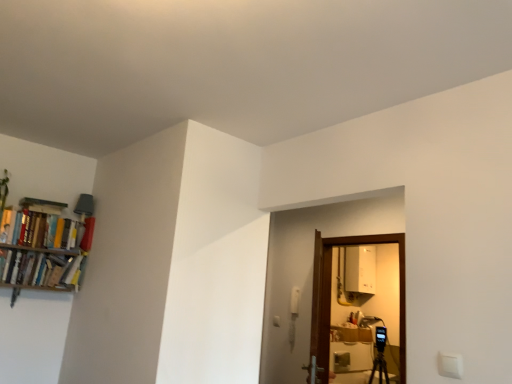
Locate an element on the screen. hardcover books at left, which is the 1th book from top to bottom is located at coordinates (44, 230).

Measure the distance between point (53, 253) and camera.

The distance of point (53, 253) from camera is 2.90 meters.

You are a GUI agent. You are given a task and a screenshot of the screen. Output one action in this format:
    pyautogui.click(x=<x>, y=<y>)
    Task: Click on the matte red book at upper left, which appears as the second book when ordered from the bottom
    The height and width of the screenshot is (384, 512).
    Given the screenshot: What is the action you would take?
    pyautogui.click(x=87, y=234)

Which is behind, matte red book at upper left, which is counted as the 2th book, starting from the top, or hardcover books at left, which ranks as the 3th book in bottom-to-top order?

matte red book at upper left, which is counted as the 2th book, starting from the top, is behind.

Is matte red book at upper left, which appears as the second book when ordered from the bottom, thinner than hardcover books at left, which is the 1th book from top to bottom?

Correct, the width of matte red book at upper left, which appears as the second book when ordered from the bottom, is less than that of hardcover books at left, which is the 1th book from top to bottom.

At what (x,y) coordinates should I click in order to perform the action: click on the 2nd book counting from the right side of the hardcover books at left, which is the 1th book from top to bottom. Please return your answer as a coordinate pair (x, y). The height and width of the screenshot is (384, 512). Looking at the image, I should click on (87, 234).

The height and width of the screenshot is (384, 512). Identify the location of the 1st book to the right of the hardcover books at left, which is the 1th book from top to bottom, counting from the anchor's position. (35, 268).

From the image's perspective, who appears lower, hardcover books at left, which is the 1th book in bottom-to-top order, or hardcover books at left, which is the 1th book from top to bottom?

hardcover books at left, which is the 1th book in bottom-to-top order, is shown below in the image.

Looking at this image, from a real-world perspective, does hardcover books at left, which is the 1th book in bottom-to-top order, stand above hardcover books at left, which is the 1th book from top to bottom?

No, from a real-world perspective, hardcover books at left, which is the 1th book in bottom-to-top order, is not above hardcover books at left, which is the 1th book from top to bottom.

Is the surface of hardcover books at left, which appears as the third book when viewed from the top, in direct contact with hardcover books at left, which ranks as the 3th book in bottom-to-top order?

No, hardcover books at left, which appears as the third book when viewed from the top, is not touching hardcover books at left, which ranks as the 3th book in bottom-to-top order.

Does hardcover books at left, which ranks as the 3th book in bottom-to-top order, appear on the left side of matte red book at upper left, which is counted as the 2th book, starting from the top?

Correct, you'll find hardcover books at left, which ranks as the 3th book in bottom-to-top order, to the left of matte red book at upper left, which is counted as the 2th book, starting from the top.

From a real-world perspective, which object stands above the other?

matte red book at upper left, which is counted as the 2th book, starting from the top, from a real-world perspective.

Is hardcover books at left, which ranks as the 3th book in bottom-to-top order, aimed at matte red book at upper left, which appears as the second book when ordered from the bottom?

No, hardcover books at left, which ranks as the 3th book in bottom-to-top order, is not aimed at matte red book at upper left, which appears as the second book when ordered from the bottom.

Can you confirm if hardcover books at left, which ranks as the 3th book in bottom-to-top order, is bigger than matte red book at upper left, which appears as the second book when ordered from the bottom?

Yes.

Which is closer, (61, 274) or (84, 225)?

Point (61, 274).

Is the position of hardcover books at left, which appears as the third book when viewed from the top, more distant than that of matte red book at upper left, which appears as the second book when ordered from the bottom?

That is False.

From the image's perspective, relative to matte red book at upper left, which appears as the second book when ordered from the bottom, is hardcover books at left, which is the 1th book in bottom-to-top order, above or below?

hardcover books at left, which is the 1th book in bottom-to-top order, is below matte red book at upper left, which appears as the second book when ordered from the bottom.

Consider the image. Considering the sizes of objects hardcover books at left, which appears as the third book when viewed from the top, and matte red book at upper left, which is counted as the 2th book, starting from the top, in the image provided, who is thinner, hardcover books at left, which appears as the third book when viewed from the top, or matte red book at upper left, which is counted as the 2th book, starting from the top,?

matte red book at upper left, which is counted as the 2th book, starting from the top, is thinner.

Considering the sizes of hardcover books at left, which is the 1th book from top to bottom, and hardcover books at left, which appears as the third book when viewed from the top, in the image, is hardcover books at left, which is the 1th book from top to bottom, wider or thinner than hardcover books at left, which appears as the third book when viewed from the top,?

In the image, hardcover books at left, which is the 1th book from top to bottom, appears to be wider than hardcover books at left, which appears as the third book when viewed from the top.

How distant is hardcover books at left, which is the 1th book from top to bottom, from hardcover books at left, which appears as the third book when viewed from the top?

14.26 centimeters.

Is hardcover books at left, which ranks as the 3th book in bottom-to-top order, positioned far away from hardcover books at left, which is the 1th book in bottom-to-top order?

No, hardcover books at left, which ranks as the 3th book in bottom-to-top order, is in close proximity to hardcover books at left, which is the 1th book in bottom-to-top order.

Considering the sizes of objects hardcover books at left, which ranks as the 3th book in bottom-to-top order, and hardcover books at left, which appears as the third book when viewed from the top, in the image provided, who is shorter, hardcover books at left, which ranks as the 3th book in bottom-to-top order, or hardcover books at left, which appears as the third book when viewed from the top,?

hardcover books at left, which appears as the third book when viewed from the top.

Between matte red book at upper left, which appears as the second book when ordered from the bottom, and hardcover books at left, which appears as the third book when viewed from the top, which one has smaller size?

matte red book at upper left, which appears as the second book when ordered from the bottom, is smaller.

In the image, is matte red book at upper left, which appears as the second book when ordered from the bottom, positioned in front of or behind hardcover books at left, which appears as the third book when viewed from the top?

Clearly, matte red book at upper left, which appears as the second book when ordered from the bottom, is behind hardcover books at left, which appears as the third book when viewed from the top.

Between matte red book at upper left, which is counted as the 2th book, starting from the top, and hardcover books at left, which is the 1th book in bottom-to-top order, which one appears on the right side from the viewer's perspective?

From the viewer's perspective, matte red book at upper left, which is counted as the 2th book, starting from the top, appears more on the right side.

There is a matte red book at upper left, which is counted as the 2th book, starting from the top. Find the location of `the 1st book below it (from a real-world perspective)`. the 1st book below it (from a real-world perspective) is located at coordinates (44, 230).

You are a GUI agent. You are given a task and a screenshot of the screen. Output one action in this format:
    pyautogui.click(x=<x>, y=<y>)
    Task: Click on the 1st book behind when counting from the hardcover books at left, which is the 1th book in bottom-to-top order
    The width and height of the screenshot is (512, 384).
    Given the screenshot: What is the action you would take?
    pyautogui.click(x=44, y=230)

Based on their spatial positions, is hardcover books at left, which appears as the third book when viewed from the top, or hardcover books at left, which ranks as the 3th book in bottom-to-top order, further from matte red book at upper left, which appears as the second book when ordered from the bottom?

The object further to matte red book at upper left, which appears as the second book when ordered from the bottom, is hardcover books at left, which appears as the third book when viewed from the top.

Which object lies further to the anchor point hardcover books at left, which is the 1th book in bottom-to-top order, hardcover books at left, which ranks as the 3th book in bottom-to-top order, or matte red book at upper left, which is counted as the 2th book, starting from the top?

matte red book at upper left, which is counted as the 2th book, starting from the top, is positioned further to the anchor hardcover books at left, which is the 1th book in bottom-to-top order.

Estimate the real-world distances between objects in this image. Which object is further from hardcover books at left, which is the 1th book from top to bottom, matte red book at upper left, which is counted as the 2th book, starting from the top, or hardcover books at left, which is the 1th book in bottom-to-top order?

matte red book at upper left, which is counted as the 2th book, starting from the top, lies further to hardcover books at left, which is the 1th book from top to bottom, than the other object.

Looking at the image, which one is located further to hardcover books at left, which appears as the third book when viewed from the top, matte red book at upper left, which is counted as the 2th book, starting from the top, or hardcover books at left, which is the 1th book from top to bottom?

matte red book at upper left, which is counted as the 2th book, starting from the top, is positioned further to the anchor hardcover books at left, which appears as the third book when viewed from the top.

Based on their spatial positions, is hardcover books at left, which ranks as the 3th book in bottom-to-top order, or hardcover books at left, which appears as the third book when viewed from the top, closer to matte red book at upper left, which appears as the second book when ordered from the bottom?

hardcover books at left, which ranks as the 3th book in bottom-to-top order, lies closer to matte red book at upper left, which appears as the second book when ordered from the bottom, than the other object.

Considering their positions, is hardcover books at left, which is the 1th book in bottom-to-top order, positioned closer to hardcover books at left, which is the 1th book from top to bottom, than matte red book at upper left, which appears as the second book when ordered from the bottom?

The object closer to hardcover books at left, which is the 1th book from top to bottom, is hardcover books at left, which is the 1th book in bottom-to-top order.

Image resolution: width=512 pixels, height=384 pixels. What are the coordinates of `book between hardcover books at left, which is the 1th book in bottom-to-top order, and matte red book at upper left, which appears as the second book when ordered from the bottom, in the front-back direction` in the screenshot? It's located at (44, 230).